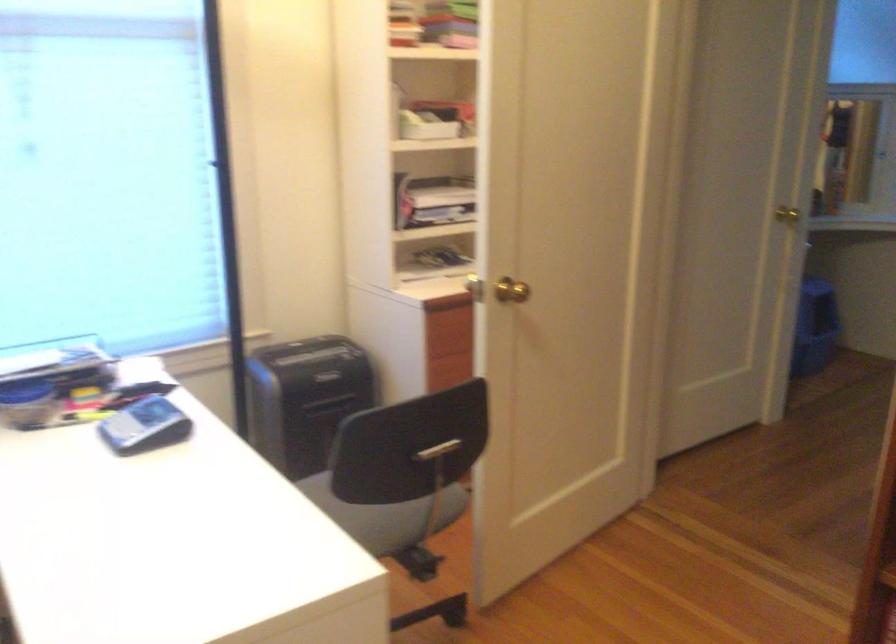
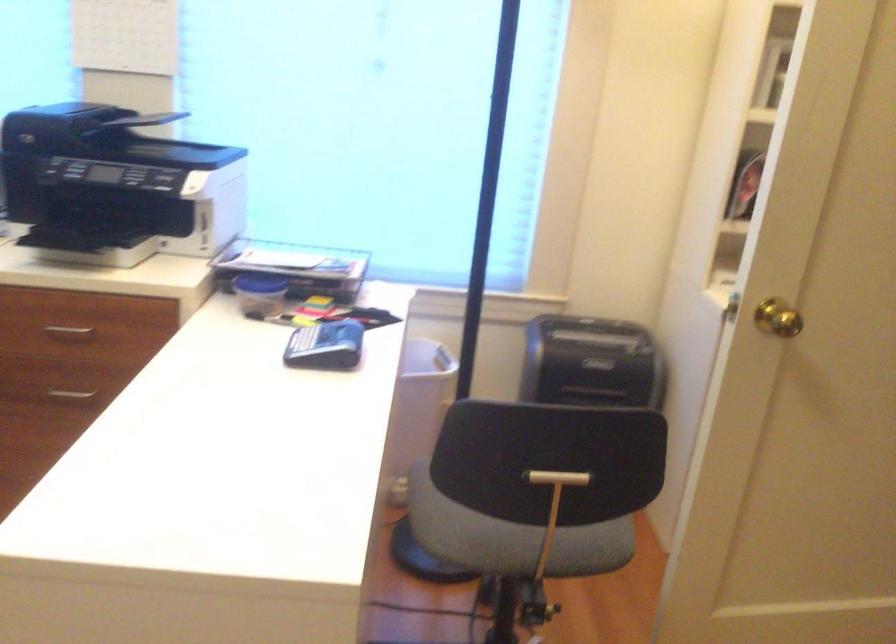
Find the pixel in the second image that matches pixel 151 426 in the first image.

(325, 346)